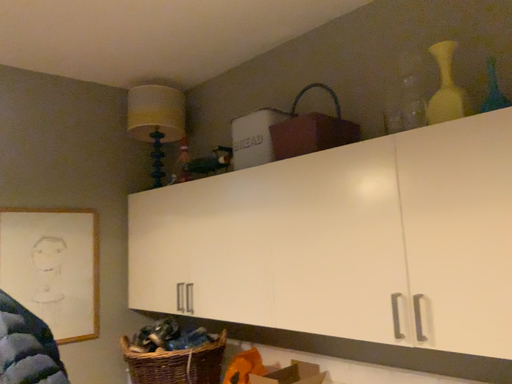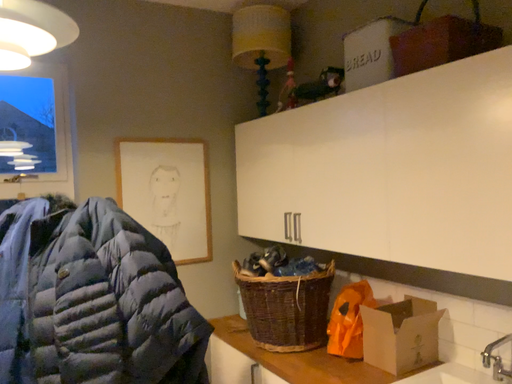
Question: Which way did the camera rotate in the video?

Choices:
 (A) rotated downward
 (B) rotated upward

Answer: (A)